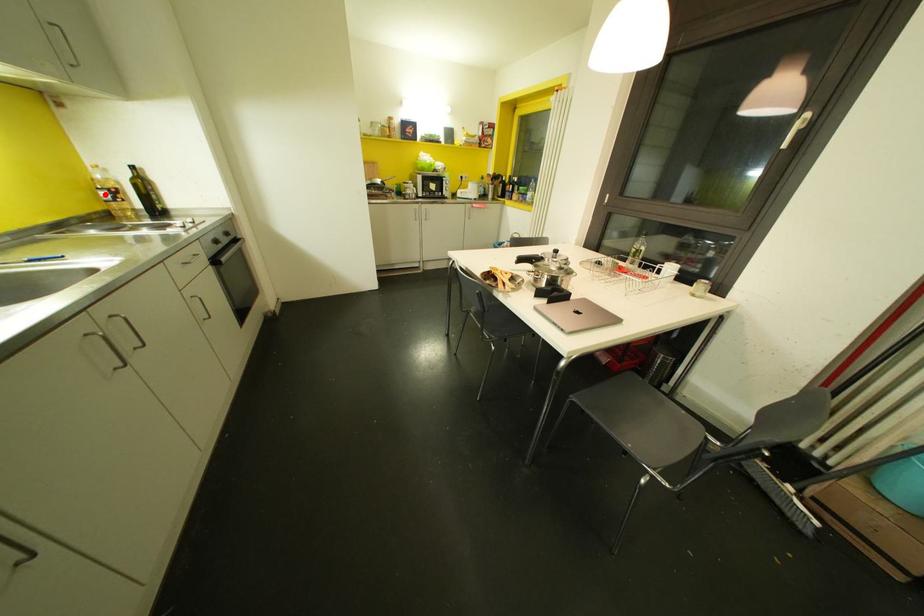
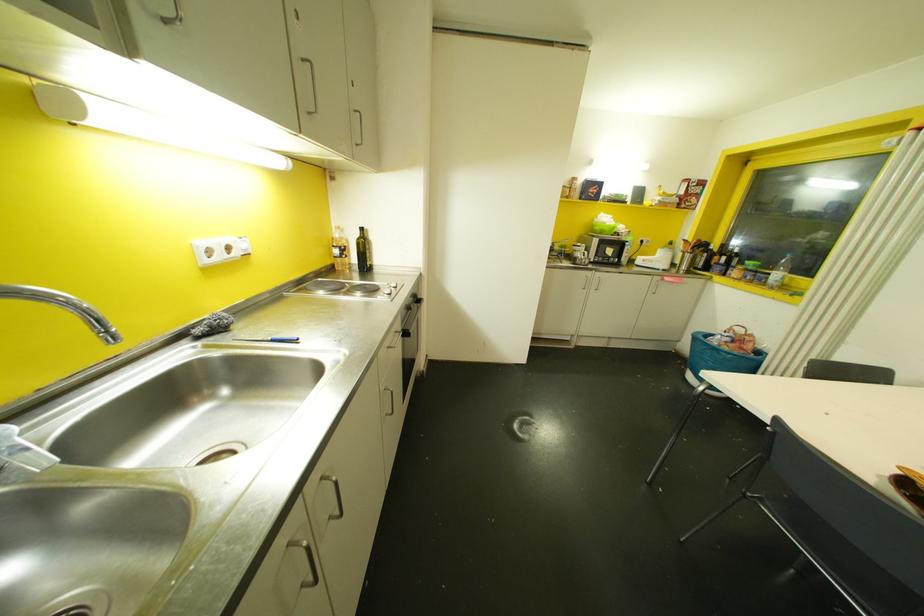
Question: I am providing you with two images of the same scene from different viewpoints. In image1, a red point is highlighted. Considering the same 3D point in image2, which of the following is correct?

Choices:
 (A) It is closer
 (B) It is farther

Answer: (A)